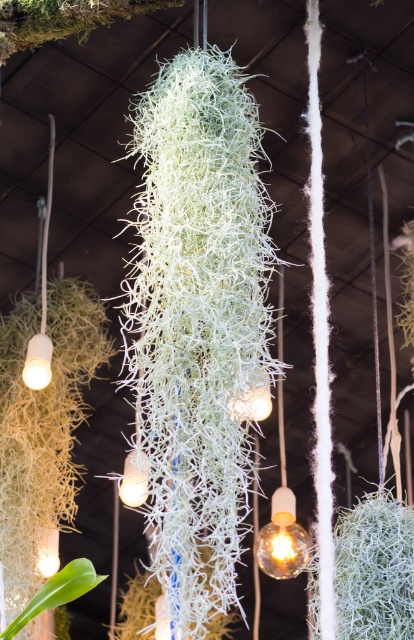
Question: Considering the relative positions of green fibrous plant at center and green leafy plant at lower left in the image provided, where is green fibrous plant at center located with respect to green leafy plant at lower left?

Choices:
 (A) below
 (B) above

Answer: (B)

Question: Which point is closer to the camera taking this photo?

Choices:
 (A) (199, 220)
 (B) (339, 572)
 (C) (72, 588)

Answer: (C)

Question: Can you confirm if white fibrous plant at center is positioned to the left of green fibrous plant at center?

Choices:
 (A) no
 (B) yes

Answer: (B)

Question: Which object is positioned farthest from the green fibrous plant at center?

Choices:
 (A) white fibrous plant at center
 (B) green leafy plant at lower left

Answer: (A)

Question: Which point appears closest to the camera in this image?

Choices:
 (A) (394, 577)
 (B) (65, 602)

Answer: (B)

Question: Can you confirm if white fibrous plant at center is smaller than green leafy plant at lower left?

Choices:
 (A) no
 (B) yes

Answer: (A)